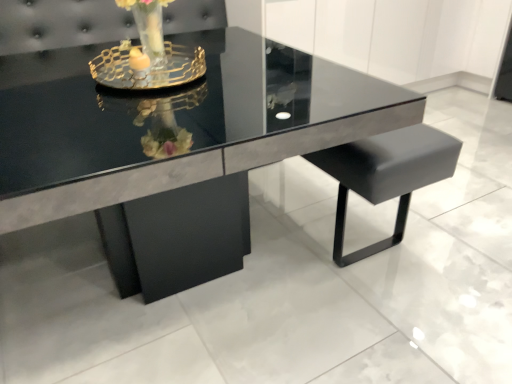
This screenshot has width=512, height=384. In order to click on glossy black table at center in this screenshot , I will do pyautogui.click(x=176, y=150).

What do you see at coordinates (176, 150) in the screenshot? This screenshot has height=384, width=512. I see `glossy black table at center` at bounding box center [176, 150].

The image size is (512, 384). Describe the element at coordinates (147, 67) in the screenshot. I see `gold metallic candle holder at upper center` at that location.

Locate an element on the screen. gold metallic candle holder at upper center is located at coordinates (147, 67).

Find the location of a particular element. glossy black table at center is located at coordinates (176, 150).

From the picture: Does glossy black table at center appear on the left side of gold metallic candle holder at upper center?

Yes.

Considering their positions, is glossy black table at center located in front of or behind gold metallic candle holder at upper center?

Clearly, glossy black table at center is in front of gold metallic candle holder at upper center.

Considering the positions of point (245, 216) and point (191, 69), is point (245, 216) closer or farther from the camera than point (191, 69)?

Point (245, 216) is farther from the camera than point (191, 69).

From the image's perspective, between glossy black table at center and gold metallic candle holder at upper center, who is located below?

glossy black table at center.

From a real-world perspective, is glossy black table at center beneath gold metallic candle holder at upper center?

Yes, from a real-world perspective, glossy black table at center is below gold metallic candle holder at upper center.

Between glossy black table at center and gold metallic candle holder at upper center, which one has larger width?

Wider between the two is glossy black table at center.

Is glossy black table at center shorter than gold metallic candle holder at upper center?

A: Incorrect, the height of glossy black table at center does not fall short of that of gold metallic candle holder at upper center.

In terms of size, does glossy black table at center appear bigger or smaller than gold metallic candle holder at upper center?

Clearly, glossy black table at center is larger in size than gold metallic candle holder at upper center.

Is glossy black table at center completely or partially outside of gold metallic candle holder at upper center?

Indeed, glossy black table at center is completely outside gold metallic candle holder at upper center.

Would you say glossy black table at center is a long distance from gold metallic candle holder at upper center?

That's right, there is a large distance between glossy black table at center and gold metallic candle holder at upper center.

Is glossy black table at center facing towards gold metallic candle holder at upper center?

No, glossy black table at center is not aimed at gold metallic candle holder at upper center.

Locate an element on the screen. This screenshot has height=384, width=512. table on the left of gold metallic candle holder at upper center is located at coordinates (176, 150).

Can you confirm if gold metallic candle holder at upper center is positioned to the left of glossy black table at center?

No.

Is gold metallic candle holder at upper center in front of or behind glossy black table at center in the image?

In the image, gold metallic candle holder at upper center appears behind glossy black table at center.

Is point (112, 70) closer or farther from the camera than point (33, 139)?

Point (112, 70).

From the image's perspective, is gold metallic candle holder at upper center located above or below glossy black table at center?

gold metallic candle holder at upper center is situated higher than glossy black table at center in the image.

From a real-world perspective, who is located lower, gold metallic candle holder at upper center or glossy black table at center?

In real-world perspective, glossy black table at center is lower.

Is gold metallic candle holder at upper center thinner than glossy black table at center?

Correct, the width of gold metallic candle holder at upper center is less than that of glossy black table at center.

Between gold metallic candle holder at upper center and glossy black table at center, which one has less height?

gold metallic candle holder at upper center.

Is gold metallic candle holder at upper center bigger or smaller than glossy black table at center?

gold metallic candle holder at upper center is smaller than glossy black table at center.

Which is correct: gold metallic candle holder at upper center is inside glossy black table at center, or outside of it?

gold metallic candle holder at upper center cannot be found inside glossy black table at center.

Is gold metallic candle holder at upper center beside glossy black table at center?

No, gold metallic candle holder at upper center is not in contact with glossy black table at center.

Is gold metallic candle holder at upper center positioned with its back to glossy black table at center?

No, gold metallic candle holder at upper center's orientation is not away from glossy black table at center.

How many degrees apart are the facing directions of gold metallic candle holder at upper center and glossy black table at center?

They differ by 3.62 degrees in their facing directions.

Locate an element on the screen. The width and height of the screenshot is (512, 384). candle holder above the glossy black table at center (from the image's perspective) is located at coordinates (147, 67).

Find the location of `candle holder on the right of glossy black table at center`. candle holder on the right of glossy black table at center is located at coordinates (147, 67).

Identify the location of table that appears below the gold metallic candle holder at upper center (from the image's perspective). The height and width of the screenshot is (384, 512). (176, 150).